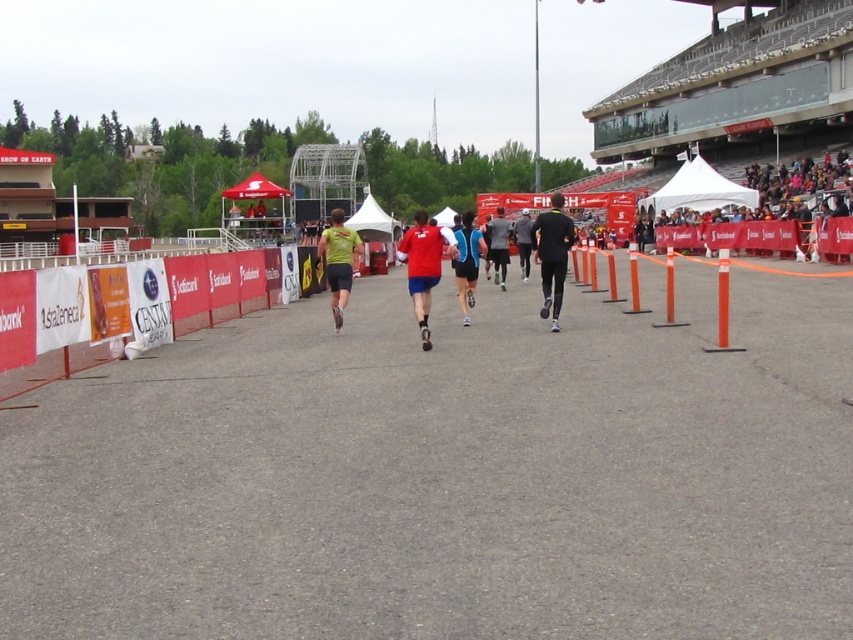
Is point (419, 321) positioned after point (332, 244)?

That is False.

Is point (425, 260) closer to camera compared to point (341, 272)?

Yes, point (425, 260) is in front of point (341, 272).

Is point (415, 301) farther from camera compared to point (338, 253)?

That is False.

At what (x,y) coordinates should I click in order to perform the action: click on matte red shirt at center. Please return your answer as a coordinate pair (x, y). Looking at the image, I should click on (424, 266).

Is gray asphalt race track at center behind matte black shorts at center?

No, it is not.

Who is positioned more to the right, gray asphalt race track at center or matte black shorts at center?

Positioned to the right is matte black shorts at center.

Which is in front, point (346, 449) or point (503, 262)?

Point (346, 449) is in front.

This screenshot has height=640, width=853. What are the coordinates of `gray asphalt race track at center` in the screenshot? It's located at (448, 474).

From the picture: Who is positioned more to the right, matte green shirt at center or matte black shorts at center?

Positioned to the right is matte black shorts at center.

Does matte green shirt at center lie in front of matte black shorts at center?

Yes, it is in front of matte black shorts at center.

Measure the distance between point (349, 280) and camera.

Point (349, 280) is 14.26 meters from camera.

Identify the location of matte green shirt at center. The image size is (853, 640). pyautogui.click(x=338, y=260).